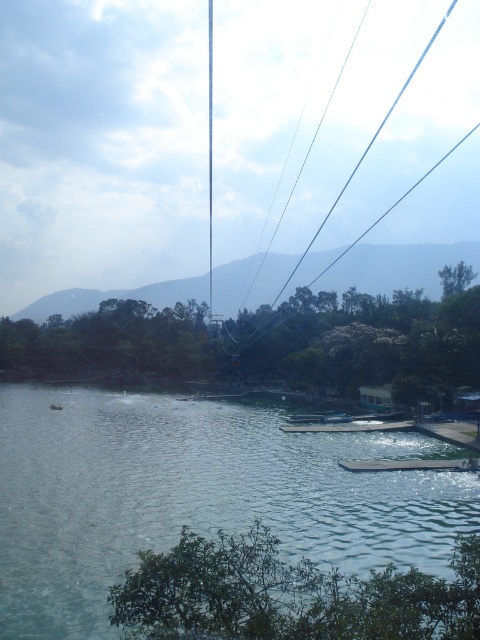
Question: Does greenish-blue water at lower left have a lesser width compared to black wire at upper center?

Choices:
 (A) yes
 (B) no

Answer: (A)

Question: Is greenish-blue water at lower left bigger than black wire at upper center?

Choices:
 (A) yes
 (B) no

Answer: (B)

Question: Among these objects, which one is farthest from the camera?

Choices:
 (A) black wire at upper center
 (B) greenish-blue water at lower left

Answer: (A)

Question: Does greenish-blue water at lower left lie behind black wire at upper center?

Choices:
 (A) no
 (B) yes

Answer: (A)